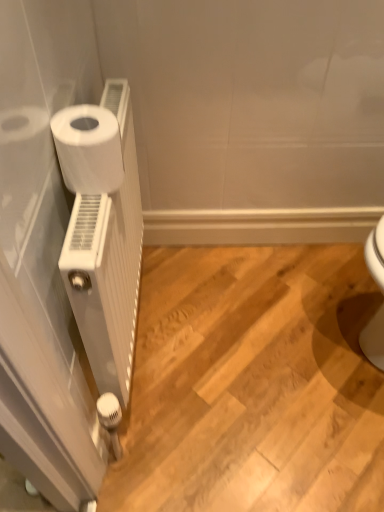
Question: Does white matte toilet paper at left have a lesser width compared to white matte radiator at left?

Choices:
 (A) yes
 (B) no

Answer: (B)

Question: Is the position of white matte toilet paper at left more distant than that of white matte radiator at left?

Choices:
 (A) no
 (B) yes

Answer: (B)

Question: Considering the relative positions of white matte toilet paper at left and white matte radiator at left in the image provided, is white matte toilet paper at left to the left of white matte radiator at left from the viewer's perspective?

Choices:
 (A) yes
 (B) no

Answer: (A)

Question: From the image's perspective, is white matte toilet paper at left located beneath white matte radiator at left?

Choices:
 (A) no
 (B) yes

Answer: (A)

Question: From the image's perspective, does white matte toilet paper at left appear higher than white matte radiator at left?

Choices:
 (A) no
 (B) yes

Answer: (B)

Question: In the image, is white matte toilet paper at left on the left side or the right side of white matte radiator at left?

Choices:
 (A) right
 (B) left

Answer: (B)

Question: From the image's perspective, is white matte toilet paper at left above or below white matte radiator at left?

Choices:
 (A) above
 (B) below

Answer: (A)

Question: In the image, is white matte toilet paper at left positioned in front of or behind white matte radiator at left?

Choices:
 (A) behind
 (B) front

Answer: (A)

Question: Considering the positions of white matte toilet paper at left and white matte radiator at left in the image, is white matte toilet paper at left taller or shorter than white matte radiator at left?

Choices:
 (A) short
 (B) tall

Answer: (A)

Question: Considering the positions of white matte radiator at left and white matte toilet paper at left in the image, is white matte radiator at left wider or thinner than white matte toilet paper at left?

Choices:
 (A) thin
 (B) wide

Answer: (A)

Question: In the image, is white matte radiator at left positioned in front of or behind white matte toilet paper at left?

Choices:
 (A) behind
 (B) front

Answer: (B)

Question: Would you say white matte radiator at left is inside or outside white matte toilet paper at left?

Choices:
 (A) inside
 (B) outside

Answer: (B)

Question: Considering the positions of white matte radiator at left and white matte toilet paper at left in the image, is white matte radiator at left bigger or smaller than white matte toilet paper at left?

Choices:
 (A) big
 (B) small

Answer: (A)

Question: Based on their sizes in the image, would you say white matte radiator at left is bigger or smaller than white matte radiator at left?

Choices:
 (A) big
 (B) small

Answer: (A)

Question: Relative to white matte radiator at left, is white matte radiator at left in front or behind?

Choices:
 (A) front
 (B) behind

Answer: (B)